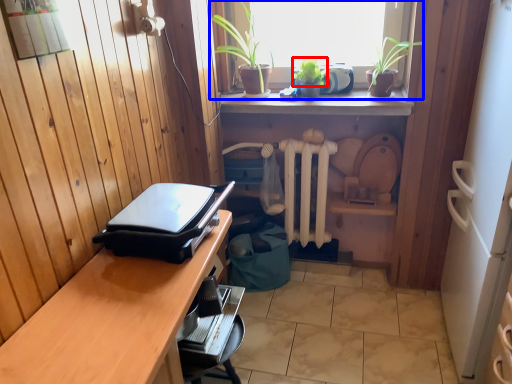
Question: Which object is closer to the camera taking this photo, plant (highlighted by a red box) or window (highlighted by a blue box)?

Choices:
 (A) plant
 (B) window

Answer: (A)